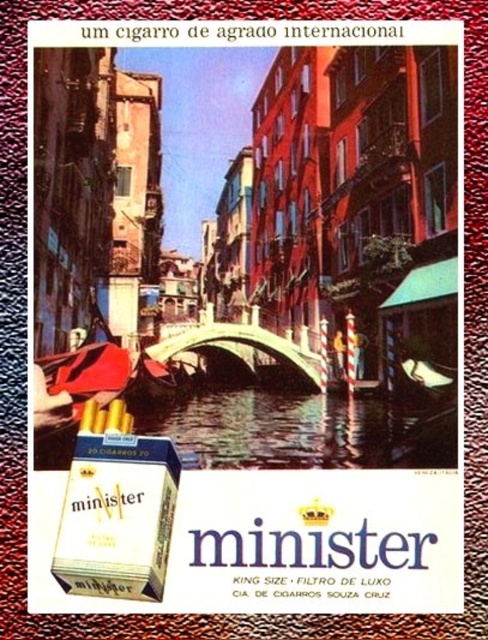
You are a delivery drone carrying a package that requires a direct flight path. You need to fly from the clear water at center to the white matte cigarette box at lower left. Can you safely navigate the 18.96 meters distance without any obstacles?

The distance between the clear water at center and the white matte cigarette box at lower left is 18.96 meters. Since there are no obstacles mentioned in the scene description, the drone can safely navigate the 18.96 meters distance directly.

You are a photographer standing at the edge of the canal in the advertisement. You want to capture a closeup shot of the clear water at center. Given that your telephoto lens can focus on objects up to 60 meters away, will you be able to take the photo without moving closer?

The clear water at center is 61.27 meters away from the camera. Since the telephoto lens can only focus up to 60 meters, you will not be able to take the closeup shot without moving closer.